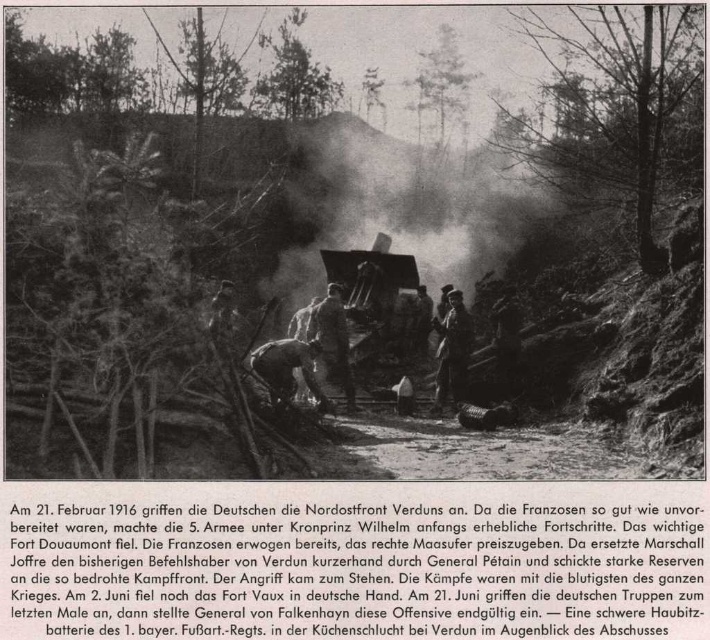
You are a soldier in World War I observing this scene. You notice a smoketransparentatcenter and a dark brown leather helmet at center. Which object appears bigger in the image?

The smoketransparentatcenter is larger in size than the dark brown leather helmet at center.

You are a soldier in World War I positioned at the point labeled as point (327,195). You need to communicate with your commander who is standing at your current position. If you move forward 30 meters along the path, will you be able to reach your commander?

The distance between you and the commander at point (327,195) is 29.86 meters. Moving forward 30 meters along the path would allow you to reach the commander since 30 meters is slightly more than the required distance of 29.86 meters.